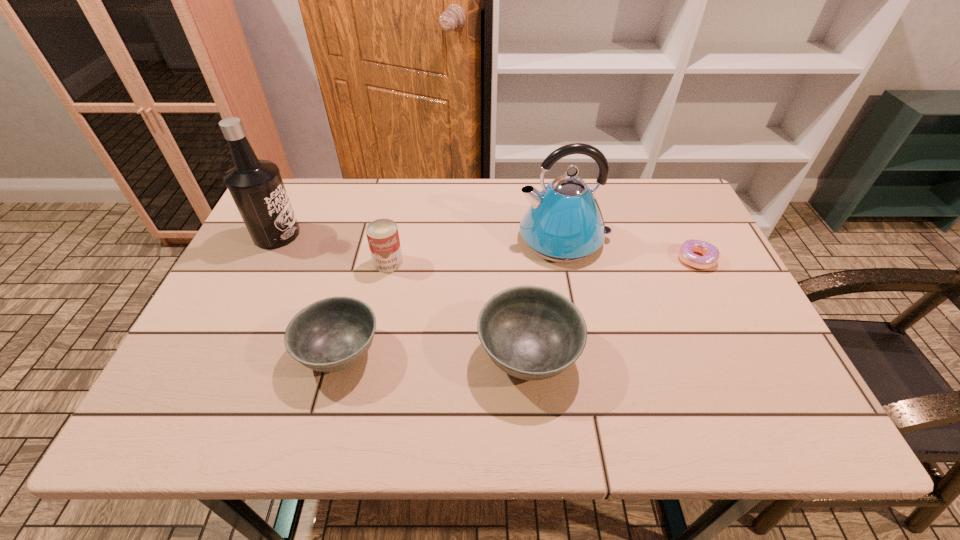
Where is `vacant area between the right bowl and the can`? This screenshot has width=960, height=540. vacant area between the right bowl and the can is located at coordinates (458, 309).

Where is `unoccupied position between the can and the leftmost object`? The width and height of the screenshot is (960, 540). unoccupied position between the can and the leftmost object is located at coordinates (332, 248).

This screenshot has width=960, height=540. In order to click on free space between the doughnut and the can in this screenshot , I will do `click(542, 261)`.

Where is `vacant area that lies between the liquor and the taller bowl`? vacant area that lies between the liquor and the taller bowl is located at coordinates (402, 295).

This screenshot has height=540, width=960. I want to click on vacant space that's between the taller bowl and the can, so [458, 309].

At what (x,y) coordinates should I click in order to perform the action: click on free area in between the second tallest object and the liquor. Please return your answer as a coordinate pair (x, y). Looking at the image, I should click on (420, 237).

Identify which object is located as the second nearest to the kettle. Please provide its 2D coordinates. Your answer should be formatted as a tuple, i.e. [(x, y)], where the tuple contains the x and y coordinates of a point satisfying the conditions above.

[(710, 253)]

Identify which object is located as the nearest to the second tallest object. Please provide its 2D coordinates. Your answer should be formatted as a tuple, i.e. [(x, y)], where the tuple contains the x and y coordinates of a point satisfying the conditions above.

[(530, 332)]

The image size is (960, 540). I want to click on free location that satisfies the following two spatial constraints: 1. on the front label of the taller bowl; 2. on the left side of the leftmost object, so click(x=217, y=355).

What are the coordinates of `vacant position in the image that satisfies the following two spatial constraints: 1. on the front label of the leftmost object; 2. on the right side of the right bowl` in the screenshot? It's located at (217, 355).